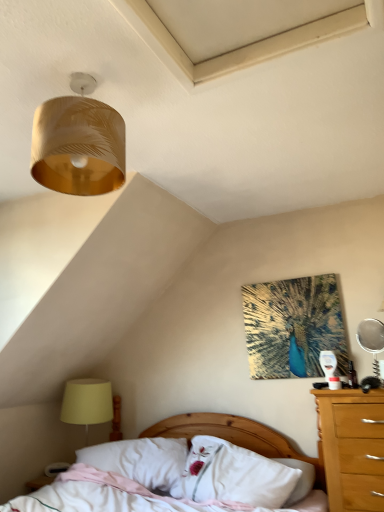
Question: Do you think gold textured lampshade at upper left is within white soft pillow at center, which is the 1th pillow in right-to-left order, or outside of it?

Choices:
 (A) outside
 (B) inside

Answer: (A)

Question: In terms of width, does gold textured lampshade at upper left look wider or thinner when compared to white soft pillow at center, positioned as the 2th pillow in left-to-right order?

Choices:
 (A) thin
 (B) wide

Answer: (B)

Question: Estimate the real-world distances between objects in this image. Which object is closer to the wooden bed at lower center?

Choices:
 (A) white soft pillow at center, positioned as the 2th pillow in left-to-right order
 (B) silver metallic mirror at right
 (C) gold textured lampshade at upper left
 (D) white soft pillow at center, acting as the first pillow starting from the left
 (E) yellow fabric lampshade at lower left

Answer: (A)

Question: Considering the real-world distances, which object is closest to the yellow fabric lampshade at lower left?

Choices:
 (A) wooden bed at lower center
 (B) white soft pillow at center, positioned as the 2th pillow in left-to-right order
 (C) white soft pillow at center, the 2th pillow when ordered from right to left
 (D) silver metallic mirror at right
 (E) gold textured lampshade at upper left

Answer: (C)